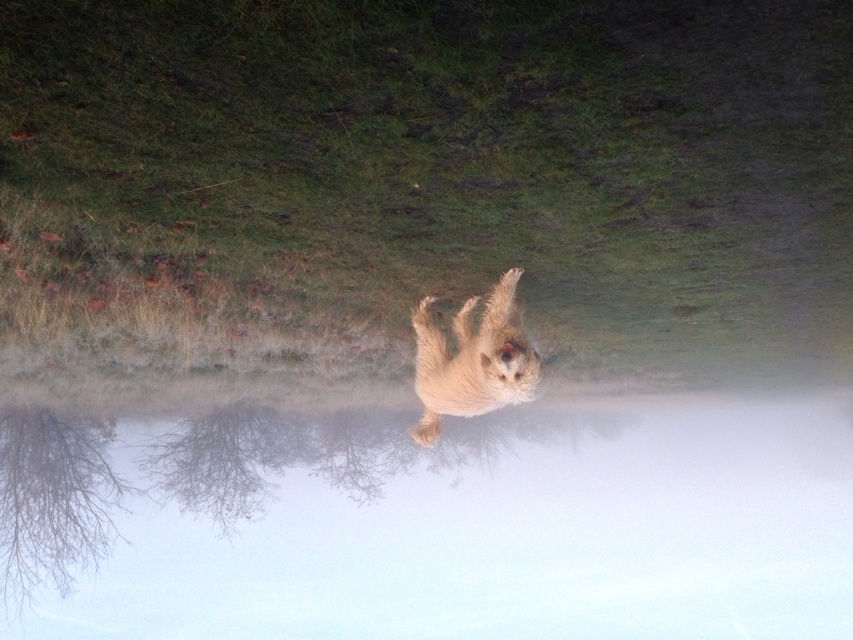
Question: Among these points, which one is farthest from the camera?

Choices:
 (A) (521, 400)
 (B) (582, 557)

Answer: (B)

Question: Can you confirm if foggy water at center is bigger than fuzzy fur dog at center?

Choices:
 (A) yes
 (B) no

Answer: (A)

Question: Is foggy water at center positioned behind fuzzy fur dog at center?

Choices:
 (A) no
 (B) yes

Answer: (B)

Question: Does foggy water at center appear on the left side of fuzzy fur dog at center?

Choices:
 (A) no
 (B) yes

Answer: (A)

Question: Which point is farther from the camera taking this photo?

Choices:
 (A) (421, 570)
 (B) (515, 339)

Answer: (A)